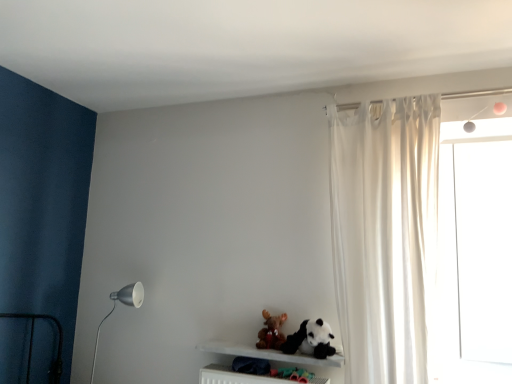
Question: Does matte white metal floor lamp at left have a lesser width compared to white matte shelf at lower center?

Choices:
 (A) no
 (B) yes

Answer: (B)

Question: Can you confirm if matte white metal floor lamp at left is bigger than white matte shelf at lower center?

Choices:
 (A) yes
 (B) no

Answer: (A)

Question: Is matte white metal floor lamp at left outside of white matte shelf at lower center?

Choices:
 (A) yes
 (B) no

Answer: (A)

Question: Can you confirm if matte white metal floor lamp at left is wider than white matte shelf at lower center?

Choices:
 (A) no
 (B) yes

Answer: (A)

Question: Are matte white metal floor lamp at left and white matte shelf at lower center located far from each other?

Choices:
 (A) no
 (B) yes

Answer: (A)

Question: From a real-world perspective, is white matte shelf at lower center positioned above or below brown plush toy at center, positioned as the first toy in left-to-right order?

Choices:
 (A) below
 (B) above

Answer: (A)

Question: Is white matte shelf at lower center in front of or behind brown plush toy at center, positioned as the first toy in left-to-right order, in the image?

Choices:
 (A) behind
 (B) front

Answer: (B)

Question: Is point [x=263, y=349] closer or farther from the camera than point [x=265, y=342]?

Choices:
 (A) closer
 (B) farther

Answer: (B)

Question: Considering the relative positions of white matte shelf at lower center and brown plush toy at center, placed as the 2th toy when sorted from right to left, in the image provided, is white matte shelf at lower center to the left or to the right of brown plush toy at center, placed as the 2th toy when sorted from right to left,?

Choices:
 (A) left
 (B) right

Answer: (A)

Question: From the image's perspective, is white sheer curtain at right positioned above or below white matte shelf at lower center?

Choices:
 (A) below
 (B) above

Answer: (B)

Question: In the image, is white sheer curtain at right positioned in front of or behind white matte shelf at lower center?

Choices:
 (A) front
 (B) behind

Answer: (A)

Question: Do you think white sheer curtain at right is within white matte shelf at lower center, or outside of it?

Choices:
 (A) outside
 (B) inside

Answer: (A)

Question: Is white sheer curtain at right wider or thinner than white matte shelf at lower center?

Choices:
 (A) wide
 (B) thin

Answer: (A)

Question: From the image's perspective, is brown plush toy at center, placed as the 2th toy when sorted from right to left, positioned above or below matte white metal floor lamp at left?

Choices:
 (A) above
 (B) below

Answer: (A)

Question: In terms of size, does brown plush toy at center, placed as the 2th toy when sorted from right to left, appear bigger or smaller than matte white metal floor lamp at left?

Choices:
 (A) big
 (B) small

Answer: (B)